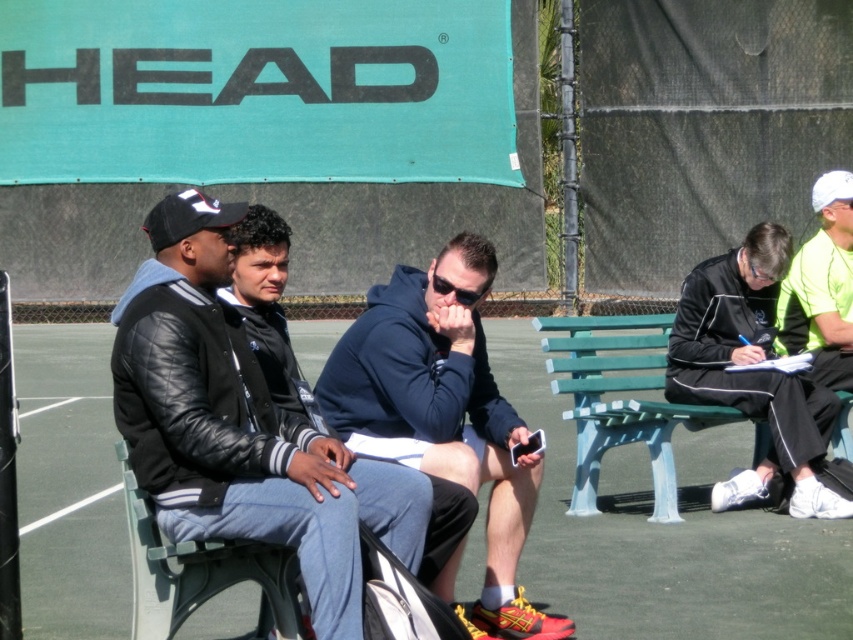
Which is more to the right, navy blue hoodie at center or green plastic bench at right?

green plastic bench at right is more to the right.

Looking at this image, which of these two, navy blue hoodie at center or green plastic bench at right, stands taller?

navy blue hoodie at center is taller.

Identify the location of navy blue hoodie at center. This screenshot has height=640, width=853. (444, 412).

Locate an element on the screen. Image resolution: width=853 pixels, height=640 pixels. navy blue hoodie at center is located at coordinates (444, 412).

Is green plastic bench at center taller than navy blue hoodie at center?

Incorrect, green plastic bench at center's height is not larger of navy blue hoodie at center's.

The width and height of the screenshot is (853, 640). In order to click on green plastic bench at center in this screenshot , I will do `click(666, 532)`.

Where is `green plastic bench at center`? The height and width of the screenshot is (640, 853). green plastic bench at center is located at coordinates (666, 532).

From the picture: Can you confirm if green plastic bench at center is bigger than black leather jacket at left?

Yes, green plastic bench at center is bigger than black leather jacket at left.

What do you see at coordinates (666, 532) in the screenshot?
I see `green plastic bench at center` at bounding box center [666, 532].

Which is in front, point (769, 568) or point (424, 504)?

Point (424, 504) is in front.

At what (x,y) coordinates should I click in order to perform the action: click on green plastic bench at center. Please return your answer as a coordinate pair (x, y). Image resolution: width=853 pixels, height=640 pixels. Looking at the image, I should click on click(666, 532).